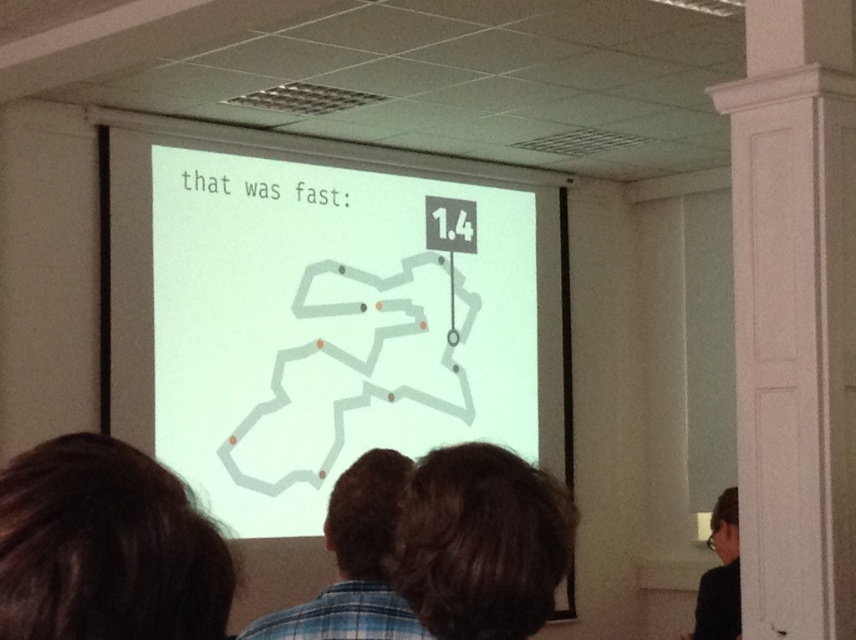
Which is behind, point (560, 506) or point (381, 609)?

Point (381, 609)

Does dark brown hair at center appear under brown plaid shirt at center?

No.

Describe the element at coordinates (480, 541) in the screenshot. I see `dark brown hair at center` at that location.

The width and height of the screenshot is (856, 640). Identify the location of dark brown hair at center. (480, 541).

Does white smooth pillar at right come behind dark brown hair at center?

Yes, white smooth pillar at right is further from the viewer.

Who is higher up, white smooth pillar at right or dark brown hair at center?

Positioned higher is white smooth pillar at right.

At what (x,y) coordinates should I click in order to perform the action: click on white smooth pillar at right. Please return your answer as a coordinate pair (x, y). Image resolution: width=856 pixels, height=640 pixels. Looking at the image, I should click on [795, 316].

Locate an element on the screen. white smooth pillar at right is located at coordinates (795, 316).

Is white matte projection screen at center closer to the viewer compared to black glossy hair at upper right?

No, it is behind black glossy hair at upper right.

Does white matte projection screen at center appear on the left side of black glossy hair at upper right?

Indeed, white matte projection screen at center is positioned on the left side of black glossy hair at upper right.

The height and width of the screenshot is (640, 856). Find the location of `white matte projection screen at center`. white matte projection screen at center is located at coordinates (322, 321).